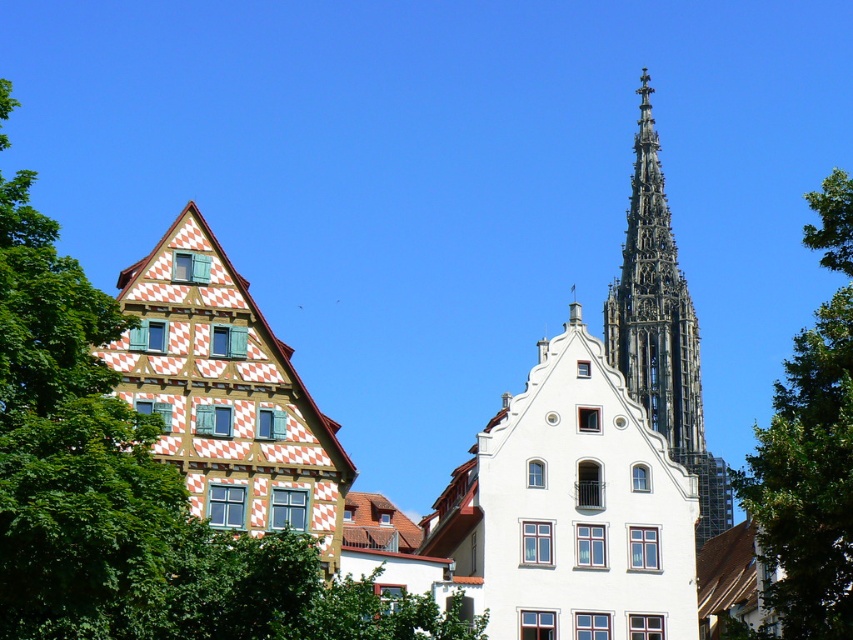
Question: Can you confirm if wooden checkered house at left is thinner than dark gray stone spire at upper right?

Choices:
 (A) yes
 (B) no

Answer: (A)

Question: Which object is closer to the camera taking this photo?

Choices:
 (A) wooden checkered house at left
 (B) green leafy tree at upper right
 (C) green leafy tree at left
 (D) dark gray stone spire at upper right

Answer: (C)

Question: Is green leafy tree at upper right to the right of dark gray stone spire at upper right from the viewer's perspective?

Choices:
 (A) yes
 (B) no

Answer: (A)

Question: Among these points, which one is farthest from the camera?

Choices:
 (A) (105, 445)
 (B) (834, 180)
 (C) (668, 275)
 (D) (228, 326)

Answer: (C)

Question: Which point is closer to the camera?

Choices:
 (A) (132, 513)
 (B) (648, 131)

Answer: (A)

Question: Does green leafy tree at left appear under dark gray stone spire at upper right?

Choices:
 (A) yes
 (B) no

Answer: (B)